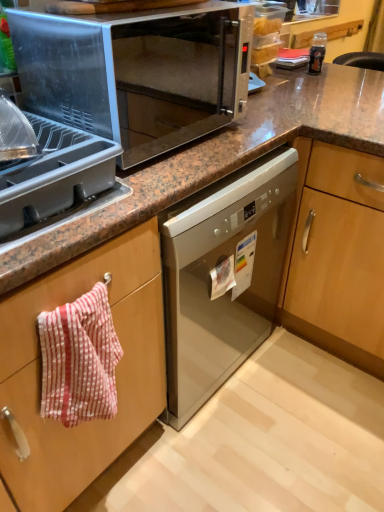
Question: Does red striped towel at left appear on the left side of gray plastic tray at upper left?

Choices:
 (A) yes
 (B) no

Answer: (B)

Question: From a real-world perspective, is red striped towel at left located higher than gray plastic tray at upper left?

Choices:
 (A) yes
 (B) no

Answer: (B)

Question: Can you confirm if red striped towel at left is bigger than gray plastic tray at upper left?

Choices:
 (A) yes
 (B) no

Answer: (B)

Question: Does red striped towel at left have a smaller size compared to gray plastic tray at upper left?

Choices:
 (A) yes
 (B) no

Answer: (A)

Question: Is red striped towel at left aimed at gray plastic tray at upper left?

Choices:
 (A) yes
 (B) no

Answer: (B)

Question: In terms of width, does red striped towel at left look wider or thinner when compared to gray plastic tray at upper left?

Choices:
 (A) thin
 (B) wide

Answer: (A)

Question: In terms of size, does red striped towel at left appear bigger or smaller than gray plastic tray at upper left?

Choices:
 (A) big
 (B) small

Answer: (B)

Question: From a real-world perspective, is red striped towel at left physically located above or below gray plastic tray at upper left?

Choices:
 (A) below
 (B) above

Answer: (A)

Question: Considering the positions of point (132, 425) and point (99, 144), is point (132, 425) closer or farther from the camera than point (99, 144)?

Choices:
 (A) farther
 (B) closer

Answer: (A)

Question: In the image, is satin silver microwave at upper center positioned in front of or behind gray plastic tray at upper left?

Choices:
 (A) behind
 (B) front

Answer: (A)

Question: Considering the positions of satin silver microwave at upper center and gray plastic tray at upper left in the image, is satin silver microwave at upper center bigger or smaller than gray plastic tray at upper left?

Choices:
 (A) small
 (B) big

Answer: (B)

Question: Looking at their shapes, would you say satin silver microwave at upper center is wider or thinner than gray plastic tray at upper left?

Choices:
 (A) thin
 (B) wide

Answer: (B)

Question: From the image's perspective, is satin silver microwave at upper center located above or below gray plastic tray at upper left?

Choices:
 (A) above
 (B) below

Answer: (A)

Question: From their relative heights in the image, would you say red striped towel at left is taller or shorter than satin silver microwave at upper center?

Choices:
 (A) tall
 (B) short

Answer: (B)

Question: Considering the positions of point (79, 441) and point (34, 65), is point (79, 441) closer or farther from the camera than point (34, 65)?

Choices:
 (A) closer
 (B) farther

Answer: (B)